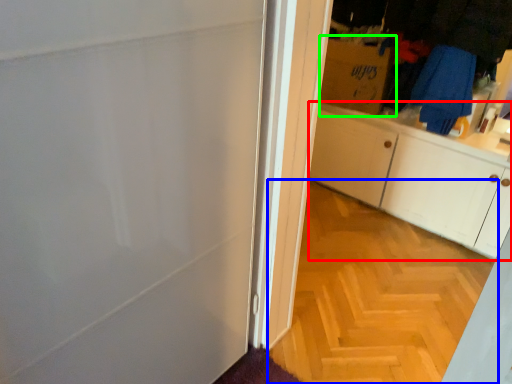
Question: Which object is the closest to the cabinetry (highlighted by a red box)? Choose among these: plain (highlighted by a blue box) or cardboard box (highlighted by a green box).

Choices:
 (A) plain
 (B) cardboard box

Answer: (B)